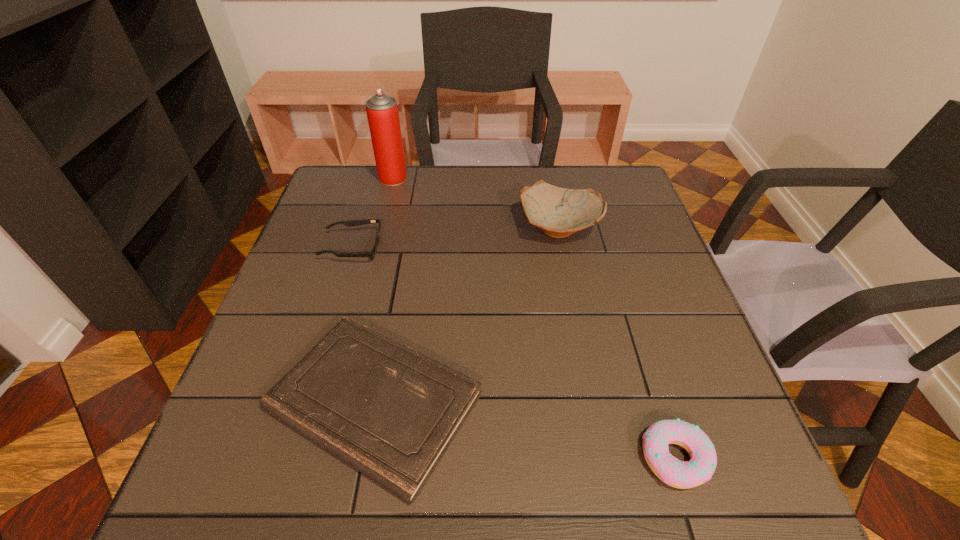
The image size is (960, 540). What are the coordinates of `the third closest object to the sunglasses` in the screenshot? It's located at (559, 212).

This screenshot has width=960, height=540. I want to click on free space that satisfies the following two spatial constraints: 1. on the front-facing side of the shortest object; 2. on the right side of the sunglasses, so click(x=305, y=402).

Locate an element on the screen. The height and width of the screenshot is (540, 960). vacant region that satisfies the following two spatial constraints: 1. on the front side of the aerosol can; 2. on the right side of the doughnut is located at coordinates (322, 458).

I want to click on vacant position in the image that satisfies the following two spatial constraints: 1. on the front side of the doughnut; 2. on the left side of the tallest object, so click(322, 458).